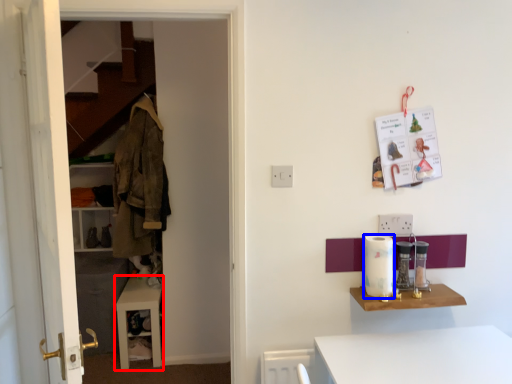
Question: Among these objects, which one is nearest to the camera, table (highlighted by a red box) or appliance (highlighted by a blue box)?

Choices:
 (A) table
 (B) appliance

Answer: (B)